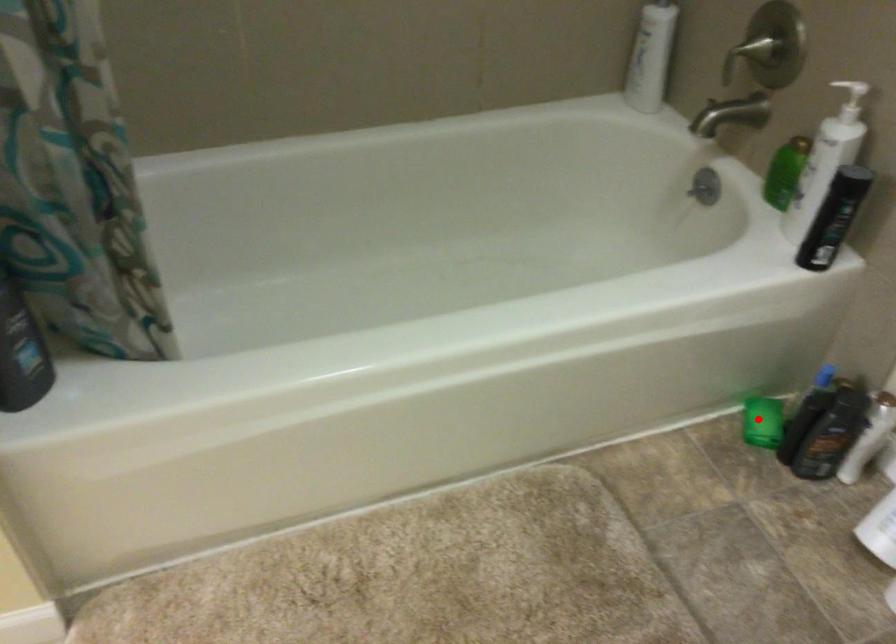
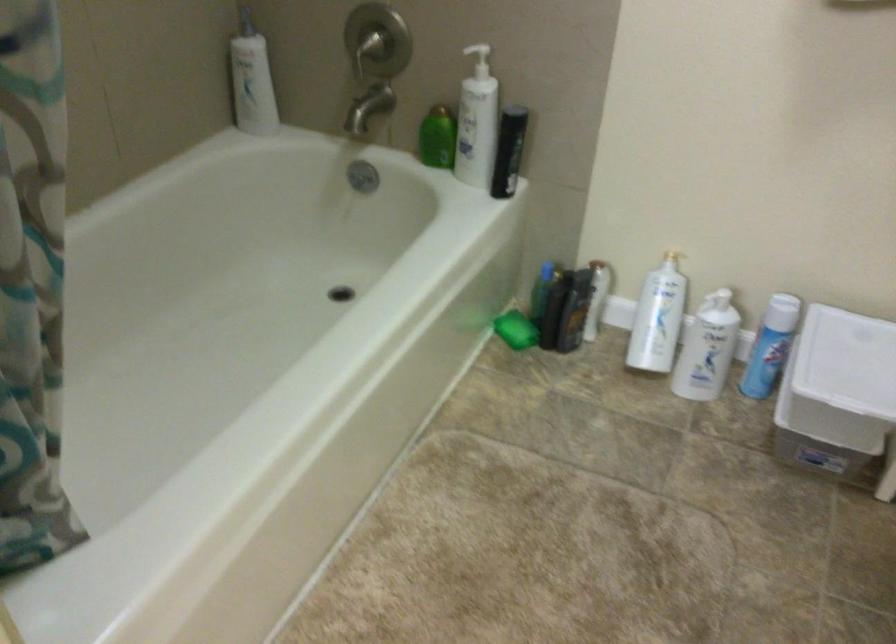
Question: A red point is marked in image1. In image2, is the corresponding 3D point closer to the camera or farther? Reply with the corresponding letter.

Choices:
 (A) The corresponding 3D point is closer.
 (B) The corresponding 3D point is farther.

Answer: (B)